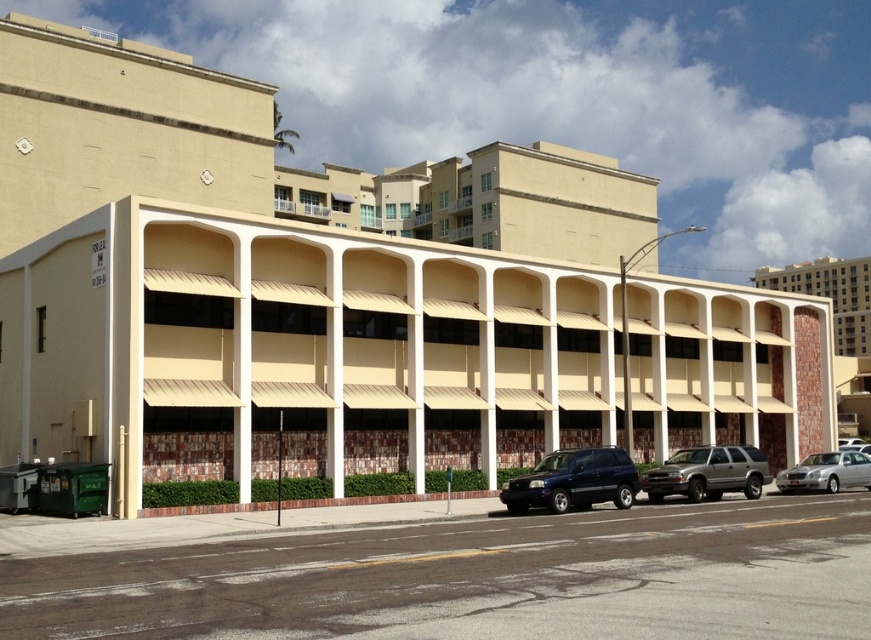
Question: Can you confirm if beige brick building at upper right is wider than satin silver suv at center?

Choices:
 (A) yes
 (B) no

Answer: (A)

Question: Which object appears farthest from the camera in this image?

Choices:
 (A) shiny dark blue suv at center
 (B) satin silver suv at center
 (C) silver metallic sedan at lower right

Answer: (C)

Question: Which point is closer to the camera?

Choices:
 (A) (831, 490)
 (B) (550, 496)

Answer: (B)

Question: In this image, where is beige brick building at upper right located relative to satin silver suv at center?

Choices:
 (A) above
 (B) below

Answer: (A)

Question: Estimate the real-world distances between objects in this image. Which object is farther from the silver metallic sedan at lower right?

Choices:
 (A) satin silver suv at center
 (B) beige brick building at upper right

Answer: (B)

Question: Does beige brick building at upper right appear on the left side of satin silver suv at center?

Choices:
 (A) yes
 (B) no

Answer: (B)